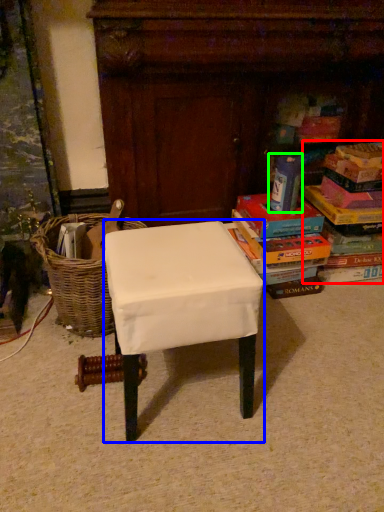
Question: Which is farther away from book (highlighted by a red box)? stool (highlighted by a blue box) or paperback book (highlighted by a green box)?

Choices:
 (A) stool
 (B) paperback book

Answer: (A)